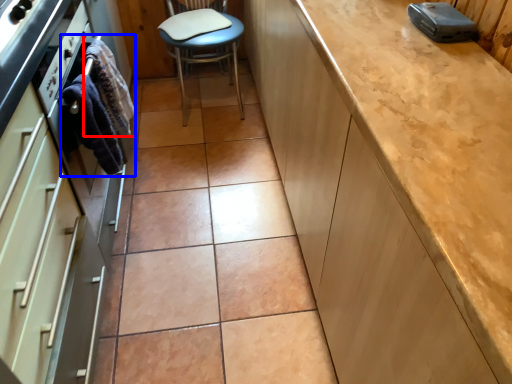
Question: Which of the following is the closest to the observer, material (highlighted by a red box) or material (highlighted by a blue box)?

Choices:
 (A) material
 (B) material

Answer: (B)